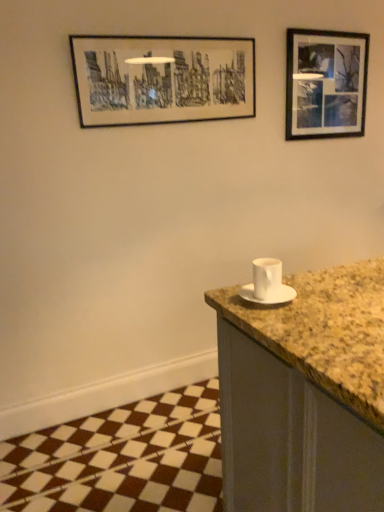
I want to click on vacant area on top of black matte picture frame at upper center, which is the 1th picture frame from front to back (from a real-world perspective), so click(x=180, y=34).